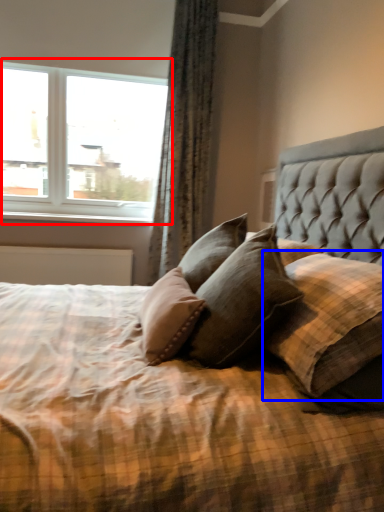
Question: Which object appears closest to the camera in this image, window (highlighted by a red box) or pillow (highlighted by a blue box)?

Choices:
 (A) window
 (B) pillow

Answer: (B)